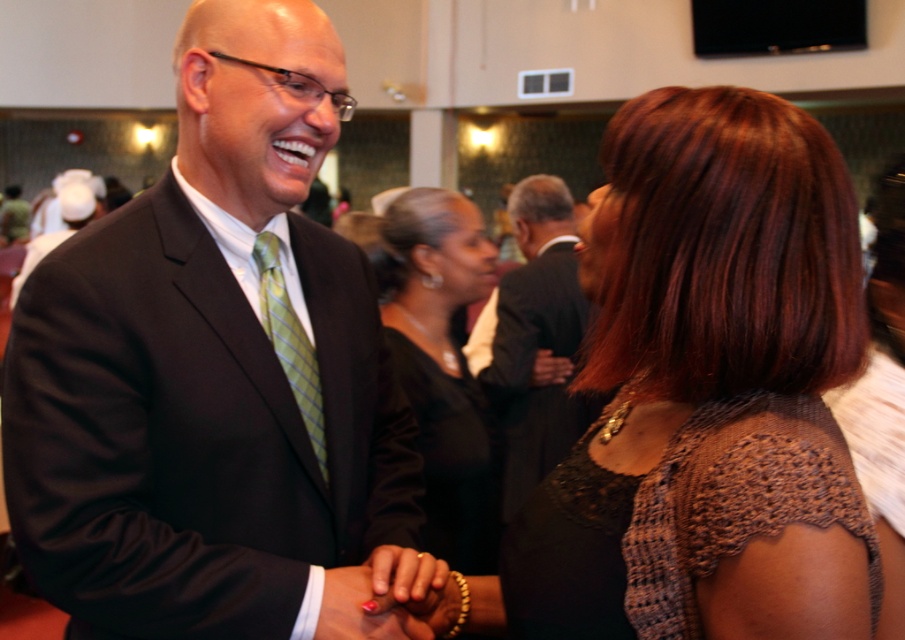
Question: Can you confirm if matte black suit at center is positioned below black satin dress at center?

Choices:
 (A) yes
 (B) no

Answer: (B)

Question: Estimate the real-world distances between objects in this image. Which object is farther from the black satin dress at center?

Choices:
 (A) matte black suit at center
 (B) brown lace dress at center
 (C) polished pink nail at center
 (D) green plaid tie at center

Answer: (C)

Question: Can you confirm if brown lace dress at center is positioned below green plaid tie at center?

Choices:
 (A) yes
 (B) no

Answer: (A)

Question: Can you confirm if black satin dress at center is wider than dark brown suit at center?

Choices:
 (A) no
 (B) yes

Answer: (A)

Question: Among these points, which one is nearest to the camera?

Choices:
 (A) (408, 273)
 (B) (312, 556)
 (C) (635, 112)

Answer: (C)

Question: Which object appears farthest from the camera in this image?

Choices:
 (A) polished pink nail at center
 (B) dark brown suit at center

Answer: (B)